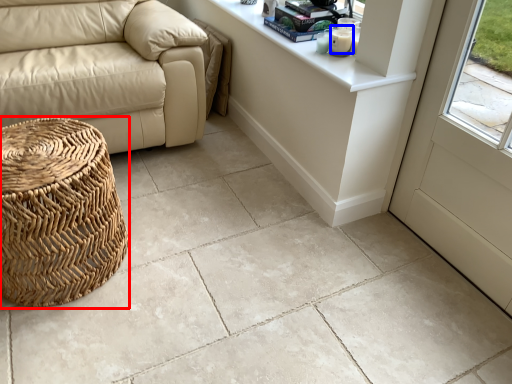
Question: Which object appears farthest to the camera in this image, basket (highlighted by a red box) or candle (highlighted by a blue box)?

Choices:
 (A) basket
 (B) candle

Answer: (B)